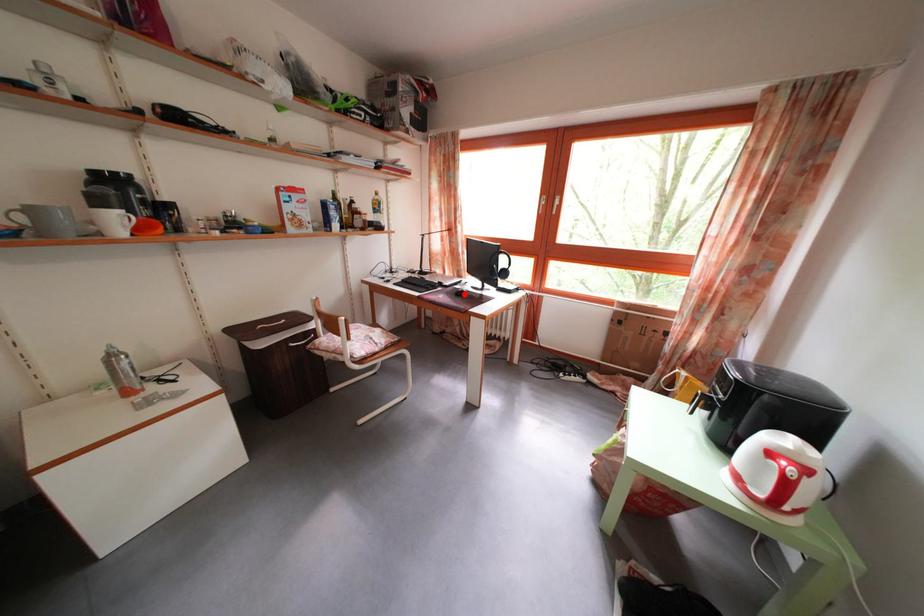
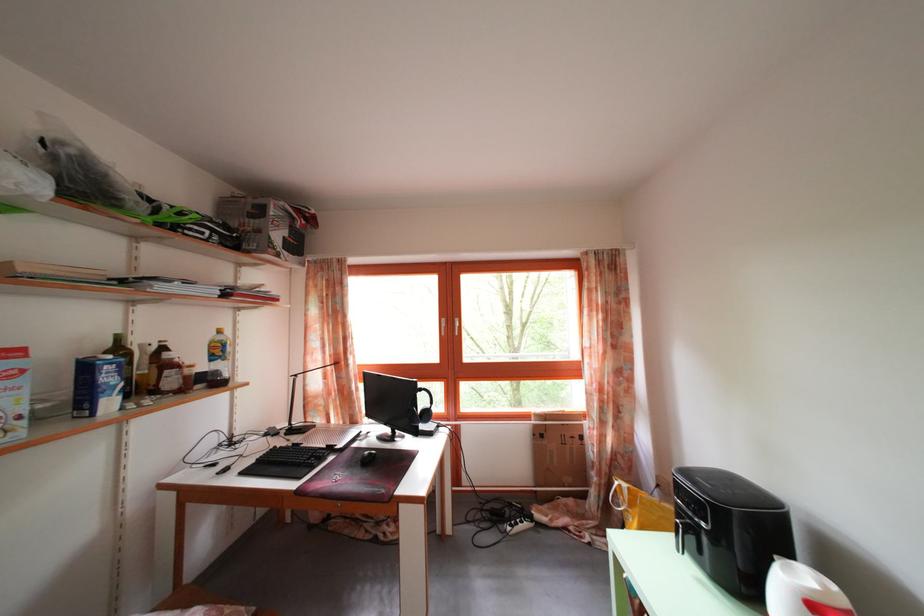
In the second image, find the point that corresponds to the highlighted location in the first image.

(363, 451)